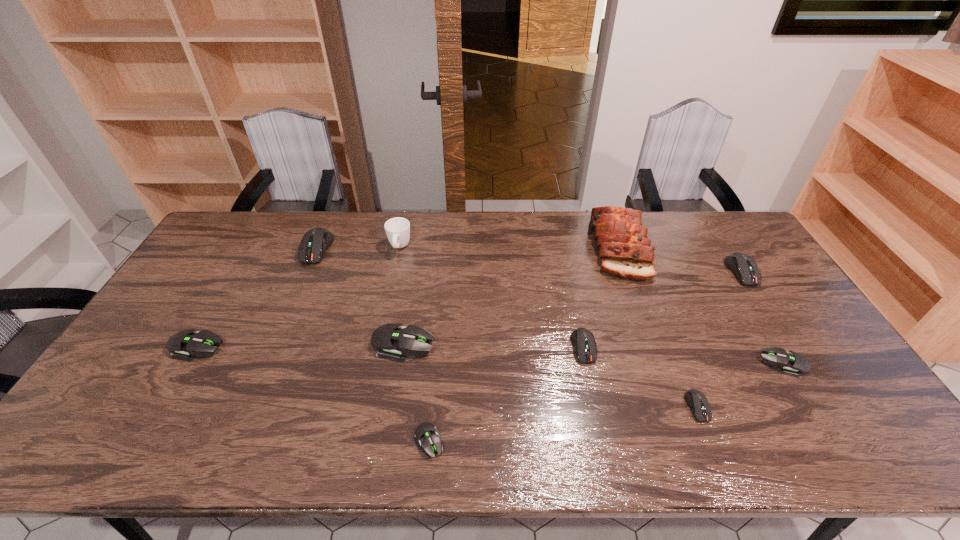
Select which object appears as the second closest to the nearest dark computer equipment. Please provide its 2D coordinates. Your answer should be formatted as a tuple, i.e. [(x, y)], where the tuple contains the x and y coordinates of a point satisfying the conditions above.

[(583, 340)]

Where is `the fifth closest object to the second dark computer equipment from left to right`? the fifth closest object to the second dark computer equipment from left to right is located at coordinates (793, 364).

Locate an element on the screen. computer mouse that is the third nearest to the biggest gray computer mouse is located at coordinates (583, 340).

Locate which computer mouse ranks seventh in proximity to the tallest computer mouse. Please provide its 2D coordinates. Your answer should be formatted as a tuple, i.e. [(x, y)], where the tuple contains the x and y coordinates of a point satisfying the conditions above.

[(745, 269)]

The image size is (960, 540). Identify the location of the closest dark computer equipment to the cup. pos(315,242).

You are a GUI agent. You are given a task and a screenshot of the screen. Output one action in this format:
    pyautogui.click(x=<x>, y=<y>)
    Task: Click on the dark computer equipment that stands as the fourth closest to the rightmost gray computer mouse
    The image size is (960, 540).
    Given the screenshot: What is the action you would take?
    pyautogui.click(x=315, y=242)

Where is `gray computer mouse that is the second closest one to the cup`? Image resolution: width=960 pixels, height=540 pixels. gray computer mouse that is the second closest one to the cup is located at coordinates (192, 343).

Select which gray computer mouse appears as the third closest to the smallest dark computer equipment. Please provide its 2D coordinates. Your answer should be formatted as a tuple, i.e. [(x, y)], where the tuple contains the x and y coordinates of a point satisfying the conditions above.

[(390, 341)]

Locate an element on the screen. This screenshot has width=960, height=540. free region that satisfies the following two spatial constraints: 1. on the button of the second smallest dark computer equipment; 2. on the left side of the second smallest gray computer mouse is located at coordinates (588, 364).